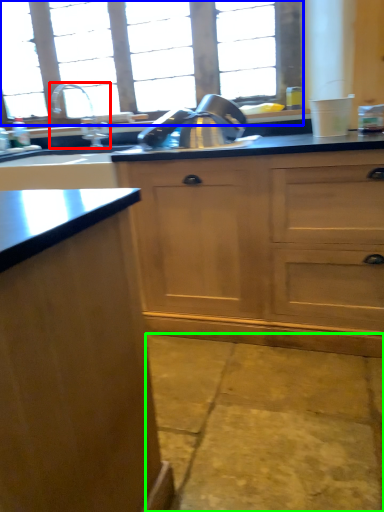
Question: Which object is positioned closest to tap (highlighted by a red box)? Select from window (highlighted by a blue box) and concrete (highlighted by a green box).

Choices:
 (A) window
 (B) concrete

Answer: (A)